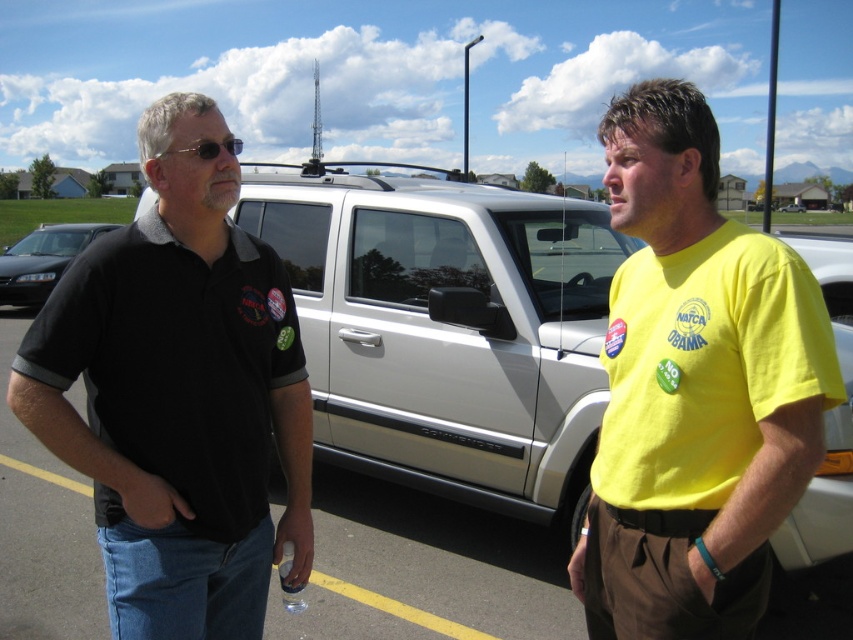
Between point (502, 404) and point (12, 257), which one is positioned behind?

The point (12, 257) is more distant.

Which is more to the right, white matte suv at center or black glossy sedan at left?

From the viewer's perspective, white matte suv at center appears more on the right side.

This screenshot has height=640, width=853. I want to click on white matte suv at center, so (x=447, y=330).

Between black matte shirt at left and white matte truck at center, which one has more height?

white matte truck at center is taller.

Describe the element at coordinates (178, 396) in the screenshot. I see `black matte shirt at left` at that location.

At what (x,y) coordinates should I click in order to perform the action: click on black matte shirt at left. Please return your answer as a coordinate pair (x, y). The image size is (853, 640). Looking at the image, I should click on (178, 396).

Can you confirm if yellow cotton t-shirt at right is positioned above black glossy sedan at left?

Incorrect, yellow cotton t-shirt at right is not positioned above black glossy sedan at left.

Is yellow cotton t-shirt at right smaller than black glossy sedan at left?

Yes, yellow cotton t-shirt at right is smaller than black glossy sedan at left.

Who is more forward, [640,432] or [74,237]?

Point [640,432] is more forward.

Where is `yellow cotton t-shirt at right`? The image size is (853, 640). yellow cotton t-shirt at right is located at coordinates (695, 388).